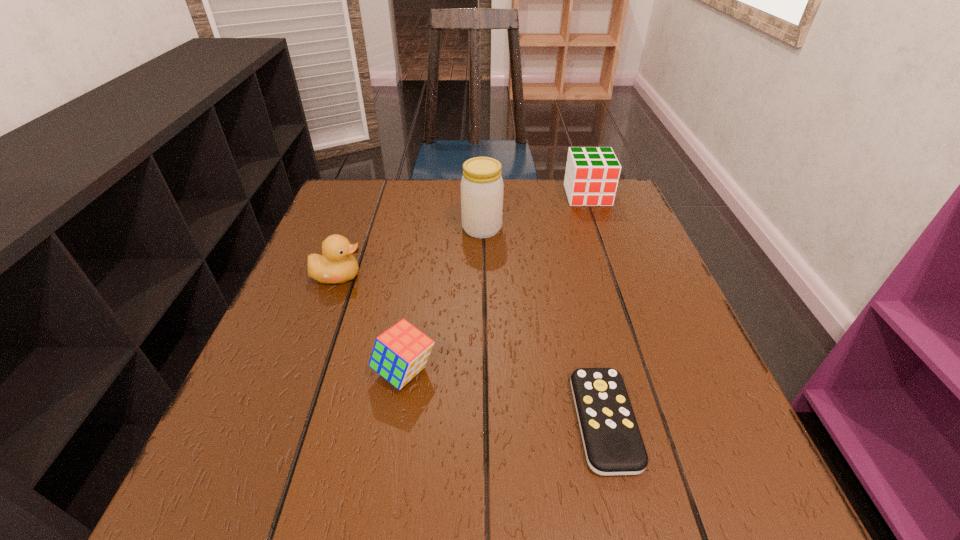
Where is `object that can be found as the second closest to the right cube`? object that can be found as the second closest to the right cube is located at coordinates (x=613, y=445).

This screenshot has height=540, width=960. What are the coordinates of `free space that satisfies the following two spatial constraints: 1. on the front side of the tallest object; 2. facing forward on the duckling` in the screenshot? It's located at (482, 276).

In order to click on free space that satisfies the following two spatial constraints: 1. on the red face of the farthest object; 2. facing forward on the third nearest object in this screenshot , I will do `click(616, 276)`.

Find the location of a particular element. This screenshot has width=960, height=540. vacant space that satisfies the following two spatial constraints: 1. facing forward on the nearer cube; 2. on the right side of the duckling is located at coordinates (302, 372).